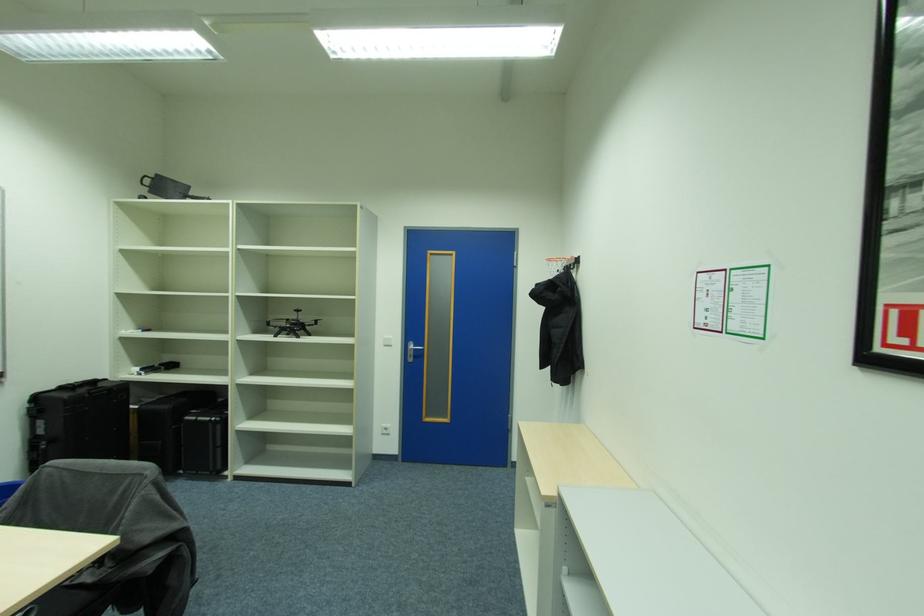
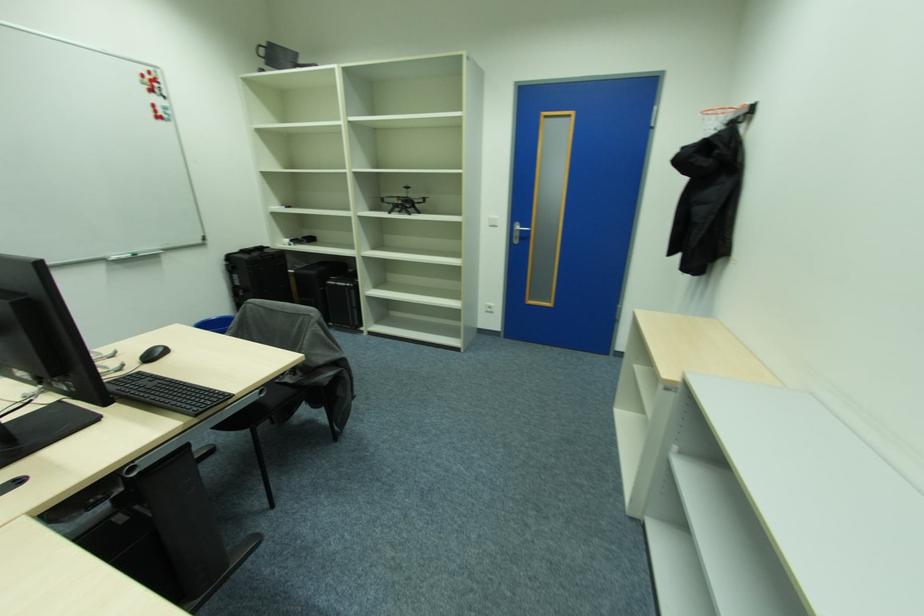
Based on the continuous images, in which direction is the camera rotating?

The camera's rotation is toward left-down.